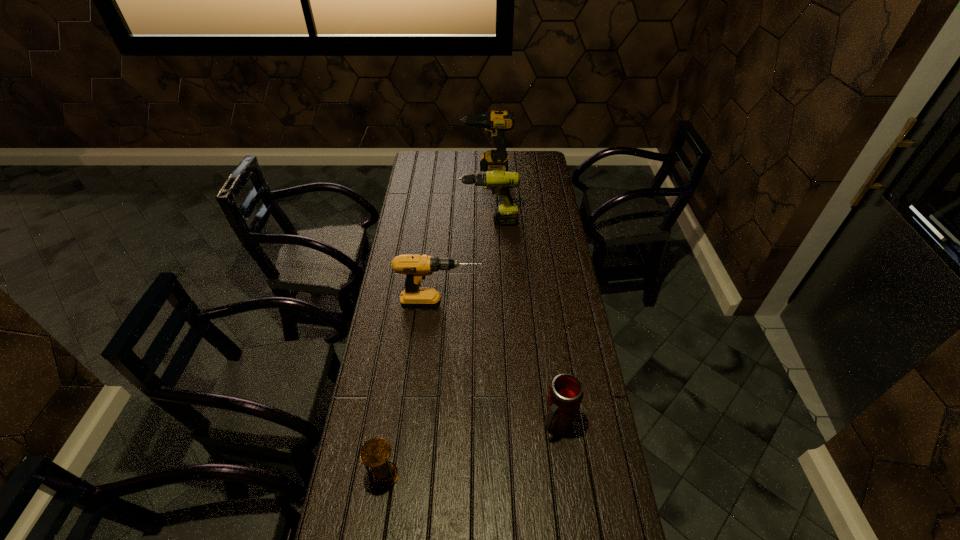
Locate an element on the screen. vacant region between the nearest drill and the fourth farthest object is located at coordinates (499, 366).

Choose which object is the second nearest neighbor to the nearest drill. Please provide its 2D coordinates. Your answer should be formatted as a tuple, i.e. [(x, y)], where the tuple contains the x and y coordinates of a point satisfying the conditions above.

[(565, 395)]

Where is `object that can be found as the third closest to the second shortest object`? The height and width of the screenshot is (540, 960). object that can be found as the third closest to the second shortest object is located at coordinates (499, 181).

Image resolution: width=960 pixels, height=540 pixels. In order to click on drill that is the second closest one to the third farthest object in this screenshot , I will do `click(495, 123)`.

Locate an element on the screen. drill that stands as the second closest to the farthest drill is located at coordinates (416, 267).

The width and height of the screenshot is (960, 540). I want to click on free space that satisfies the following two spatial constraints: 1. at the tip of the nearest drill; 2. on the front side of the nearest object, so click(x=426, y=476).